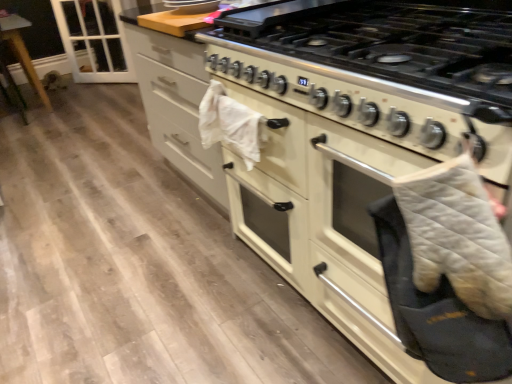
Question: Is point (411, 248) closer or farther from the camera than point (117, 51)?

Choices:
 (A) closer
 (B) farther

Answer: (A)

Question: Considering the positions of gray quilted oven mitt at right and transparent glass door at upper left in the image, is gray quilted oven mitt at right bigger or smaller than transparent glass door at upper left?

Choices:
 (A) small
 (B) big

Answer: (A)

Question: Estimate the real-world distances between objects in this image. Which object is closer to the white glossy gas stove at center?

Choices:
 (A) transparent glass door at upper left
 (B) gray quilted oven mitt at right
 (C) white quilted oven mitt at right

Answer: (C)

Question: Which object is the farthest from the gray quilted oven mitt at right?

Choices:
 (A) white glossy gas stove at center
 (B) transparent glass door at upper left
 (C) white quilted oven mitt at right

Answer: (B)